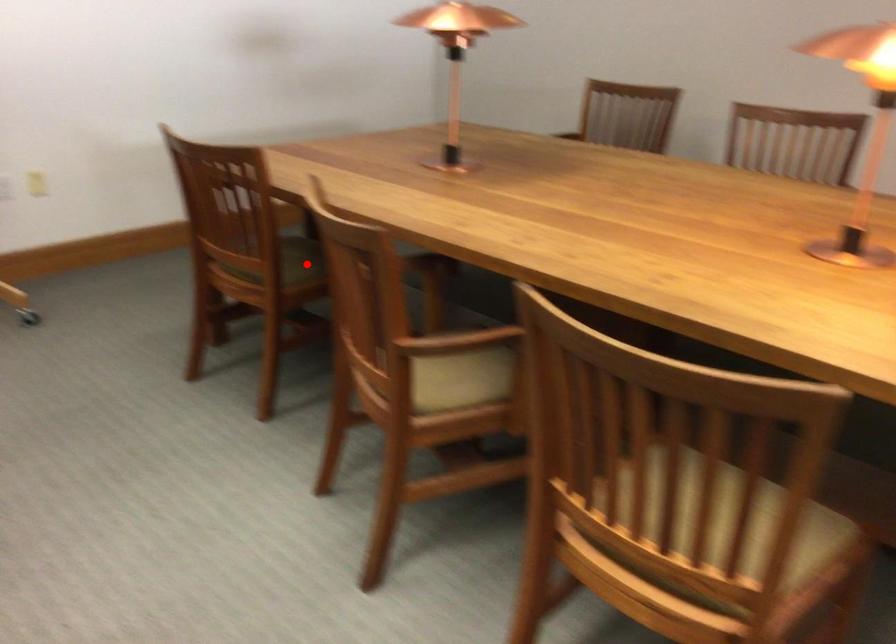
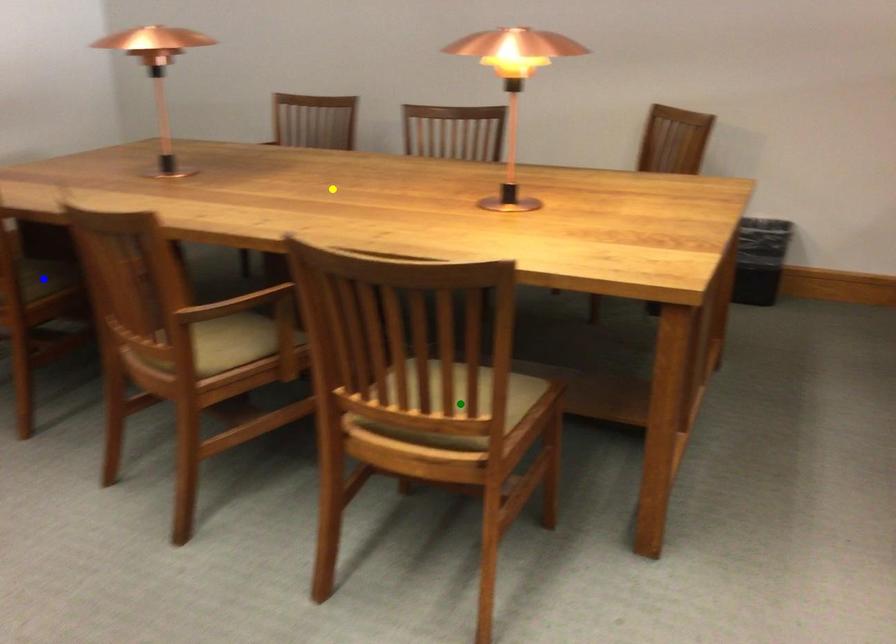
Question: I am providing you with two images of the same scene from different viewpoints. A red point is marked on the first image. You are given multiple points on the second image. Which point in image 2 represents the same 3d spot as the red point in image 1?

Choices:
 (A) green point
 (B) yellow point
 (C) blue point

Answer: (C)